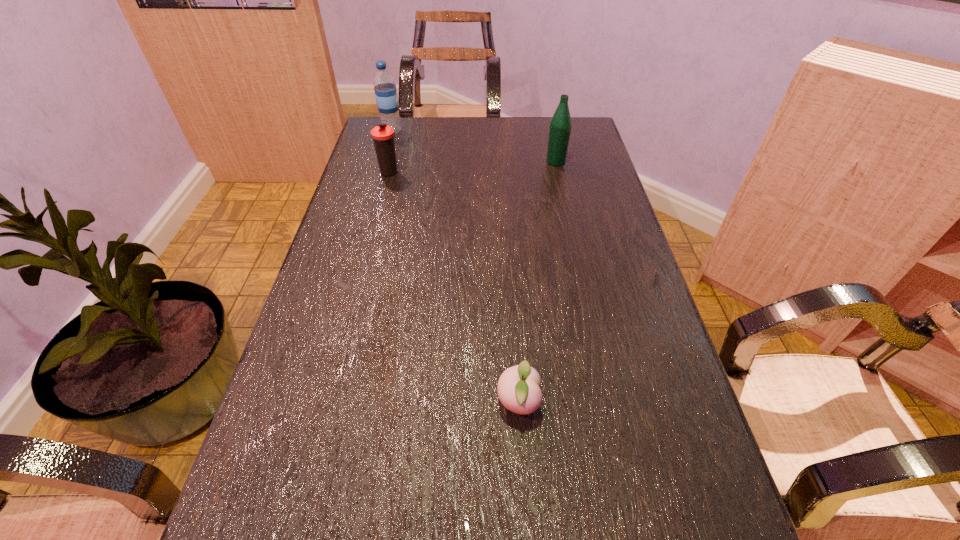
Identify the location of water bottle. This screenshot has width=960, height=540. [385, 90].

Locate an element on the screen. the rightmost object is located at coordinates (560, 125).

Locate an element on the screen. Image resolution: width=960 pixels, height=540 pixels. the second shortest object is located at coordinates (383, 135).

Where is `the shortest object`? the shortest object is located at coordinates (518, 388).

In order to click on the nearest object in this screenshot , I will do `click(518, 388)`.

Locate an element on the screen. This screenshot has width=960, height=540. vacant area situated on the label of the farthest object is located at coordinates (510, 132).

The width and height of the screenshot is (960, 540). What are the coordinates of `vacant space located 0.190m on the back of the rightmost object` in the screenshot? It's located at (548, 127).

Find the location of a particular element. This screenshot has width=960, height=540. vacant space positioned on the right of the third tallest object is located at coordinates (462, 172).

You are a GUI agent. You are given a task and a screenshot of the screen. Output one action in this format:
    pyautogui.click(x=<x>, y=<y>)
    Task: Click on the vacant space located on the right of the nearest object
    The width and height of the screenshot is (960, 540).
    Given the screenshot: What is the action you would take?
    pyautogui.click(x=653, y=403)

This screenshot has width=960, height=540. Identify the location of object that is at the far edge. (385, 90).